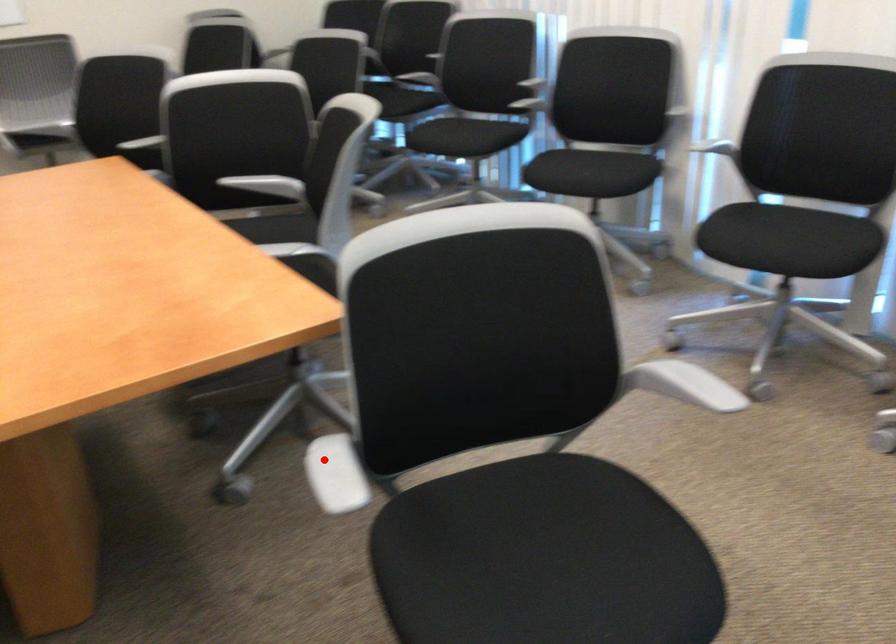
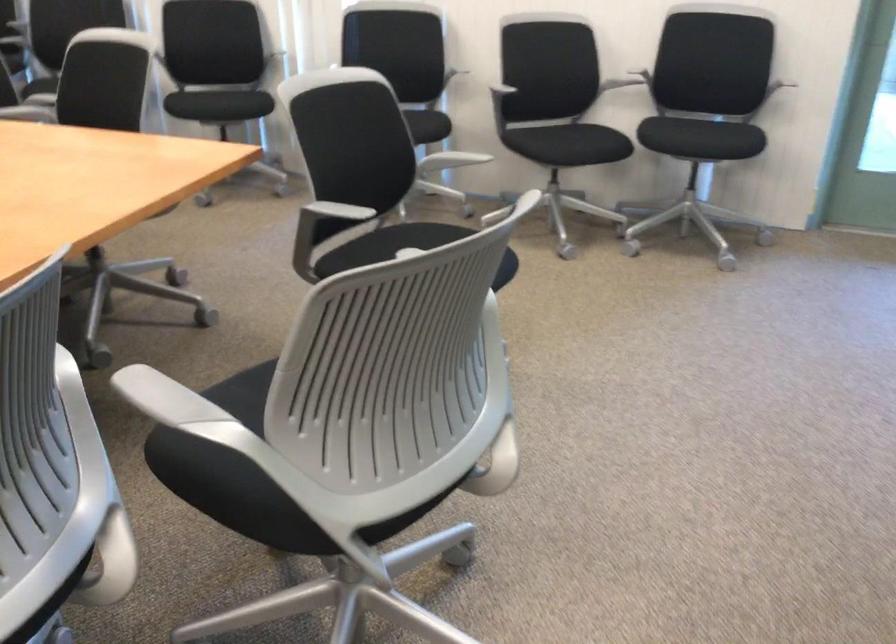
In the second image, find the point that corresponds to the highlighted location in the first image.

(332, 212)